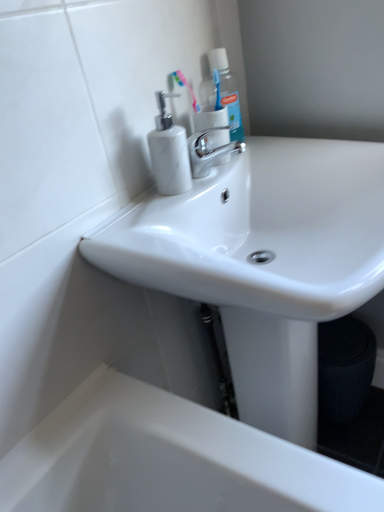
The width and height of the screenshot is (384, 512). I want to click on vacant area that lies in front of white marble soap dispenser at upper left, so click(150, 217).